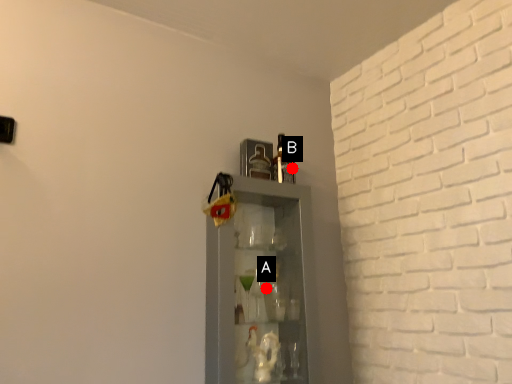
Question: Two points are circled on the image, labeled by A and B beside each circle. Among these points, which one is farthest from the camera?

Choices:
 (A) A is further
 (B) B is further

Answer: (B)